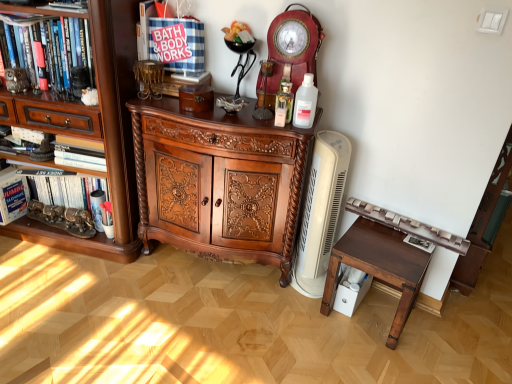
Question: Is matte red wooden clock at upper center oriented towards white cardboard box at left, acting as the 2th book starting from the right?

Choices:
 (A) no
 (B) yes

Answer: (A)

Question: Considering the relative sizes of matte red wooden clock at upper center and white cardboard box at left, acting as the 2th book starting from the right, in the image provided, is matte red wooden clock at upper center smaller than white cardboard box at left, acting as the 2th book starting from the right,?

Choices:
 (A) no
 (B) yes

Answer: (A)

Question: From the image's perspective, is matte red wooden clock at upper center on white cardboard box at left, which is the 1th book from left to right?

Choices:
 (A) yes
 (B) no

Answer: (A)

Question: Is matte red wooden clock at upper center further to the viewer compared to white cardboard box at left, which is the 1th book from left to right?

Choices:
 (A) no
 (B) yes

Answer: (A)

Question: Is matte red wooden clock at upper center beside white cardboard box at left, acting as the 2th book starting from the right?

Choices:
 (A) yes
 (B) no

Answer: (B)

Question: Is matte red wooden clock at upper center in front of white cardboard box at left, which is the 1th book from left to right?

Choices:
 (A) yes
 (B) no

Answer: (A)

Question: Does metallic owl at left have a smaller size compared to white cardboard box at left, which is the 1th book from left to right?

Choices:
 (A) no
 (B) yes

Answer: (B)

Question: Is metallic owl at left thinner than white cardboard box at left, which is the 1th book from left to right?

Choices:
 (A) yes
 (B) no

Answer: (A)

Question: From the image's perspective, is metallic owl at left over white cardboard box at left, acting as the 2th book starting from the right?

Choices:
 (A) no
 (B) yes

Answer: (B)

Question: From the image's perspective, is metallic owl at left under white cardboard box at left, which is the 1th book from left to right?

Choices:
 (A) yes
 (B) no

Answer: (B)

Question: Is metallic owl at left aimed at white cardboard box at left, acting as the 2th book starting from the right?

Choices:
 (A) no
 (B) yes

Answer: (A)

Question: Considering the relative sizes of metallic owl at left and white cardboard box at left, acting as the 2th book starting from the right, in the image provided, is metallic owl at left bigger than white cardboard box at left, acting as the 2th book starting from the right,?

Choices:
 (A) yes
 (B) no

Answer: (B)

Question: Is clear plastic bottle at center at the right side of hardcover book at left, which ranks as the second book in left-to-right order?

Choices:
 (A) yes
 (B) no

Answer: (A)